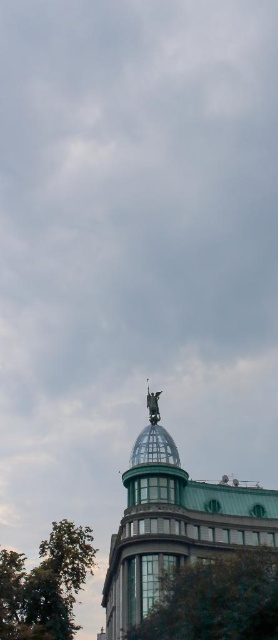
You are standing in front of the modern building and want to take a photo that includes both the green leafy tree at lower left and the polished bronze statue at top. Which object should you focus on first to ensure both are in frame?

The green leafy tree at lower left is much taller than the polished bronze statue at top, so focusing on the tree first will help ensure both are in frame.